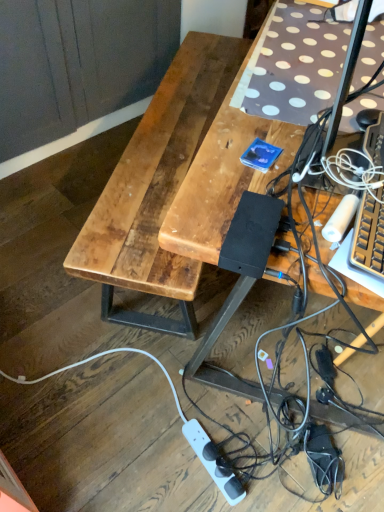
Find the location of a particular element. The image size is (384, 512). vacant space to the left of white plastic power strip at lower center is located at coordinates (149, 454).